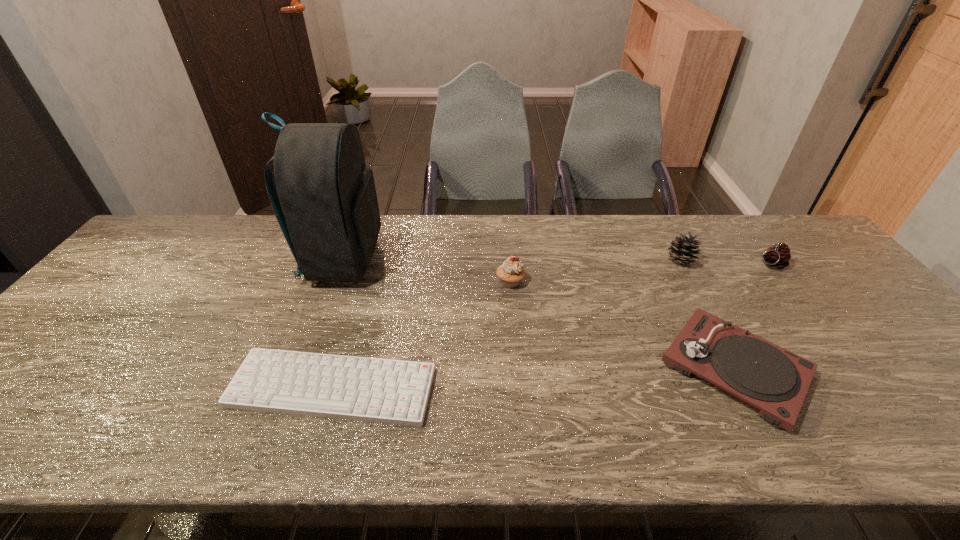
The width and height of the screenshot is (960, 540). In order to click on vacant area between the shorter pinecone and the fifth tallest object in this screenshot , I will do `click(753, 316)`.

Find the location of a particular element. The width and height of the screenshot is (960, 540). unoccupied position between the phonograph_record and the tallest object is located at coordinates pyautogui.click(x=539, y=314).

Where is `free spot between the fourth object from right to left and the left pinecone`? The height and width of the screenshot is (540, 960). free spot between the fourth object from right to left and the left pinecone is located at coordinates (595, 271).

Locate an element on the screen. Image resolution: width=960 pixels, height=540 pixels. object that is the second closest to the shortest object is located at coordinates (511, 272).

Locate an element on the screen. The height and width of the screenshot is (540, 960). object that stands as the fifth closest to the taller pinecone is located at coordinates (326, 204).

Locate an element on the screen. Image resolution: width=960 pixels, height=540 pixels. vacant space that satisfies the following two spatial constraints: 1. on the back side of the computer keyboard; 2. on the front-facing side of the tallest object is located at coordinates (371, 259).

Identify the location of vacant space that satisfies the following two spatial constraints: 1. on the back side of the second shortest object; 2. on the front-facing side of the backpack. [677, 259].

Find the location of a particular element. This screenshot has width=960, height=540. blank space that satisfies the following two spatial constraints: 1. on the front-facing side of the backpack; 2. on the right side of the shortest object is located at coordinates (296, 388).

At what (x,y) coordinates should I click in order to perform the action: click on vacant space that satisfies the following two spatial constraints: 1. on the front-facing side of the second shortest object; 2. on the right side of the tallest object. Please return your answer as a coordinate pair (x, y). The height and width of the screenshot is (540, 960). Looking at the image, I should click on (302, 368).

Locate an element on the screen. This screenshot has height=540, width=960. blank space that satisfies the following two spatial constraints: 1. on the back side of the computer keyboard; 2. on the front-facing side of the backpack is located at coordinates (371, 259).